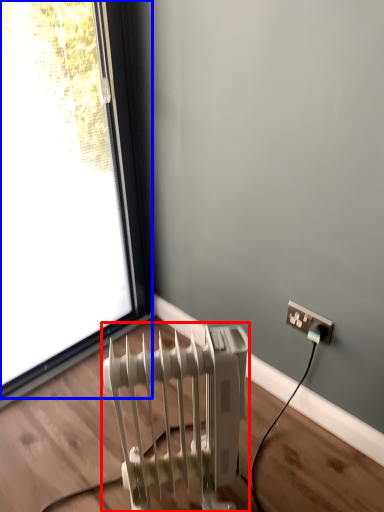
Question: Which of the following is the closest to the observer, radiator (highlighted by a red box) or window (highlighted by a blue box)?

Choices:
 (A) radiator
 (B) window

Answer: (A)